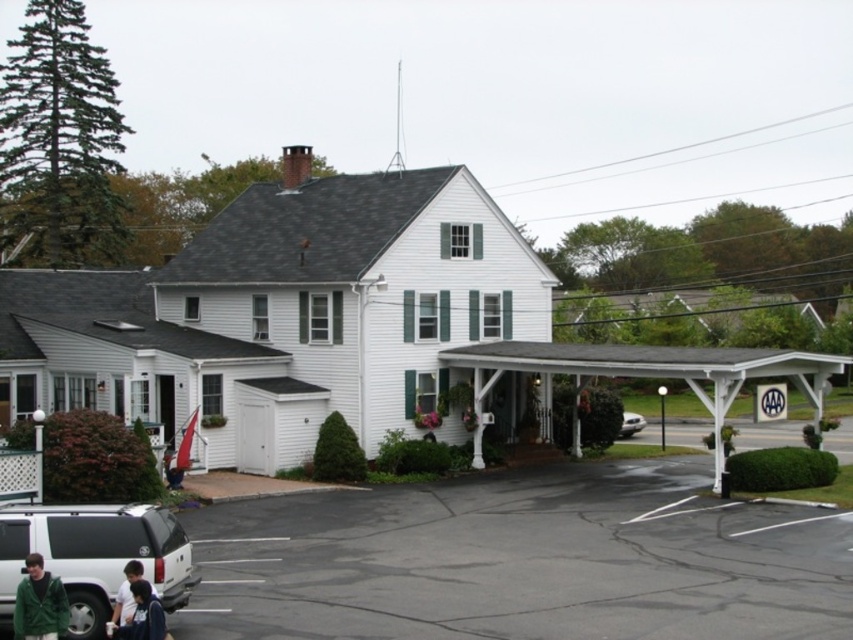
You are standing at the front porch of the two story white house with green shutters. You see a point marked at (39, 604). What object is located at that point?

The point at (39, 604) marks the green fleece jacket at lower left.

You are standing in front of the house and want to walk to the green fleece jacket at lower left. Which direction should you move relative to the black asphalt parking lot at lower center?

To reach the green fleece jacket at lower left, you should move towards the black asphalt parking lot at lower center because it is closer to you than the jacket.